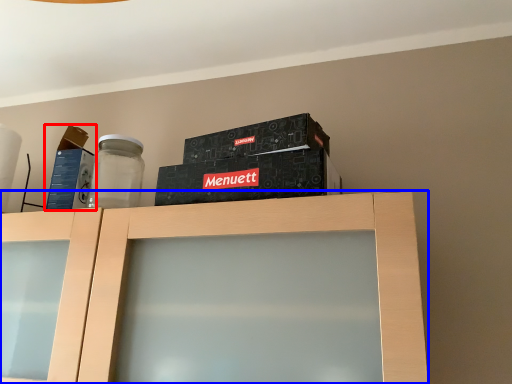
Question: Which object appears farthest to the camera in this image, box (highlighted by a red box) or cabinetry (highlighted by a blue box)?

Choices:
 (A) box
 (B) cabinetry

Answer: (A)